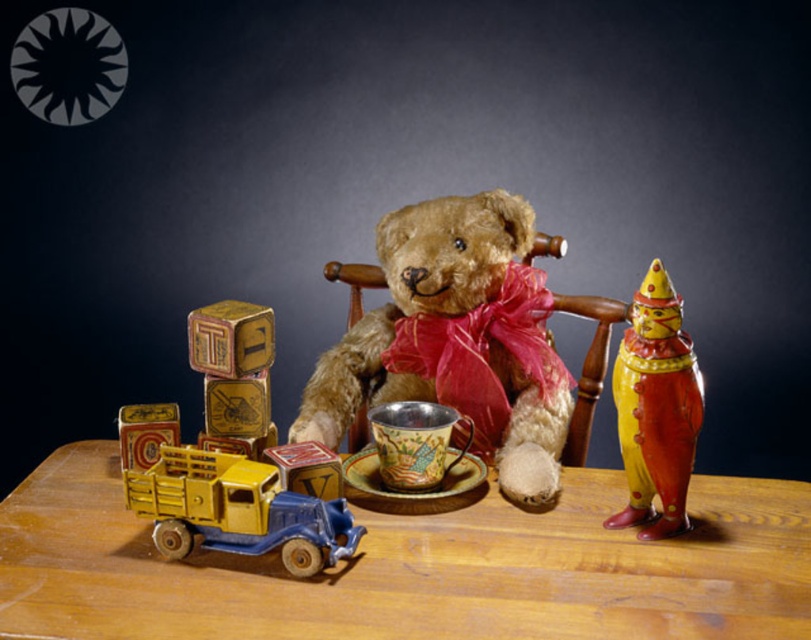
Is point (151, 516) behind point (694, 369)?

No, it is not.

I want to click on metallic blue truck at lower left, so click(237, 509).

Who is positioned more to the right, metallic blue truck at lower left or metallic yellow truck at lower left?

From the viewer's perspective, metallic blue truck at lower left appears more on the right side.

Which is below, metallic blue truck at lower left or metallic yellow truck at lower left?

metallic blue truck at lower left is below.

Which is in front, point (226, 477) or point (118, 416)?

Point (226, 477)

Identify the location of metallic blue truck at lower left. The width and height of the screenshot is (811, 640). (237, 509).

Is point (423, 298) less distant than point (204, 330)?

No, (423, 298) is further to viewer.

Who is more forward, (419, 314) or (260, 353)?

Positioned in front is point (260, 353).

Where is `soft brown teddy bear at center`? The width and height of the screenshot is (811, 640). soft brown teddy bear at center is located at coordinates (453, 339).